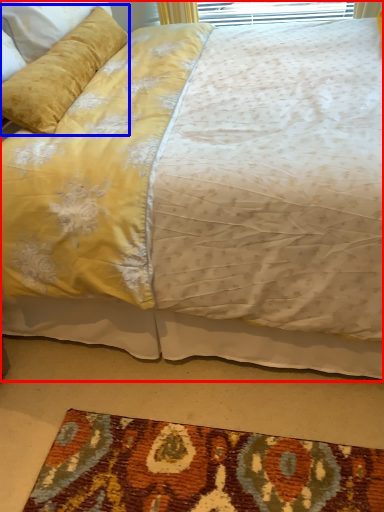
Question: Which point is closer to the camera, bed (highlighted by a red box) or pillow (highlighted by a blue box)?

Choices:
 (A) bed
 (B) pillow

Answer: (A)